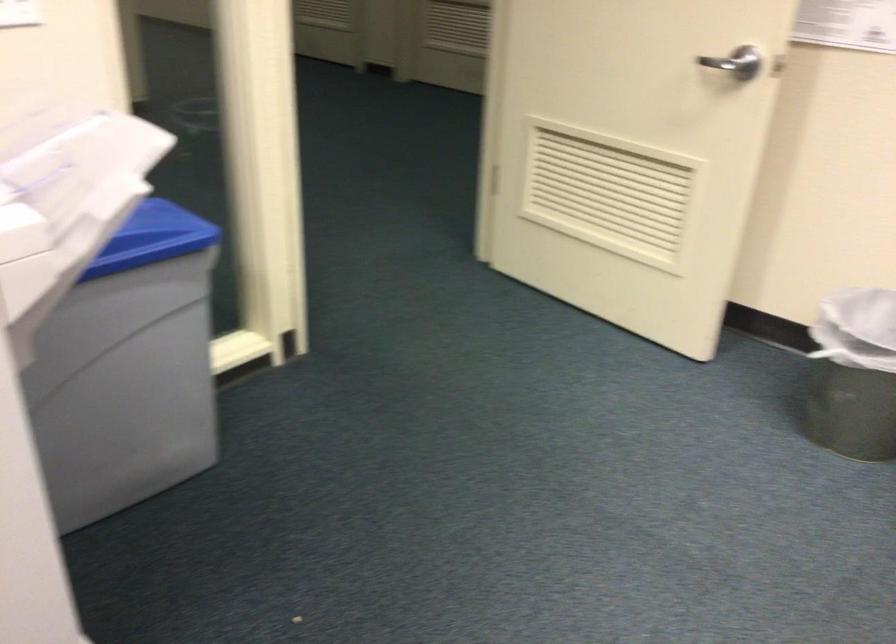
How did the camera likely rotate?

The rotation direction of the camera is right-down.